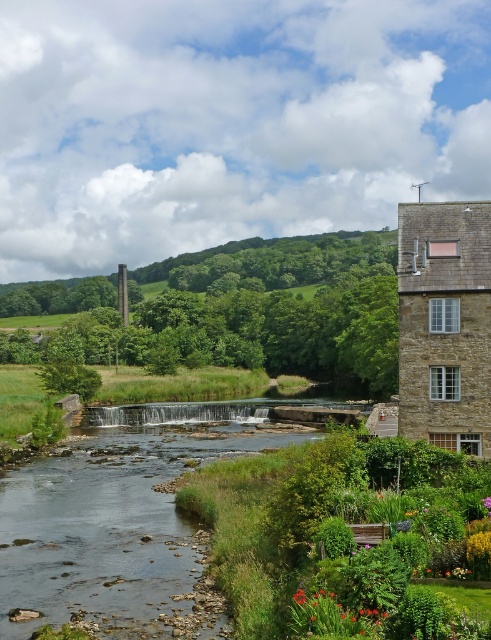
Locate an element on the screen. This screenshot has width=491, height=640. green leafy garden at lower right is located at coordinates (332, 538).

What do you see at coordinates (332, 538) in the screenshot? The image size is (491, 640). I see `green leafy garden at lower right` at bounding box center [332, 538].

Does point (345, 525) come behind point (168, 524)?

No, it is not.

You are a GUI agent. You are given a task and a screenshot of the screen. Output one action in this format:
    pyautogui.click(x=<x>, y=<y>)
    Task: Click on the green leafy garden at lower right
    
    Given the screenshot: What is the action you would take?
    pyautogui.click(x=332, y=538)